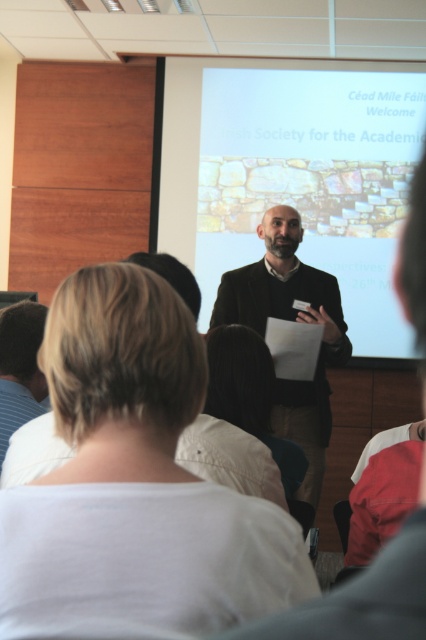
You are an event planner organizing a presentation. You need to decide whether the matte stone wall at center will cover the dark brown suit at center on the projection screen. Based on the description, what should you consider?

The matte stone wall at center has a larger size compared to the dark brown suit at center, so it will cover the dark brown suit at center on the projection screen.

You are an attendee at the presentation. You notice the white cotton shirt at center and the matte stone wall at center. Which object is larger in size?

The white cotton shirt at center has a smaller size compared to the matte stone wall at center, so the matte stone wall at center is larger in size.